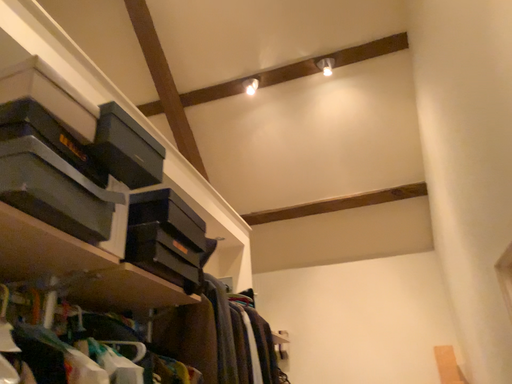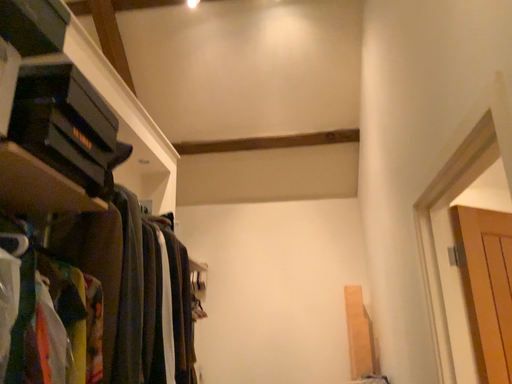
Question: How did the camera likely rotate when shooting the video?

Choices:
 (A) rotated right
 (B) rotated left

Answer: (A)